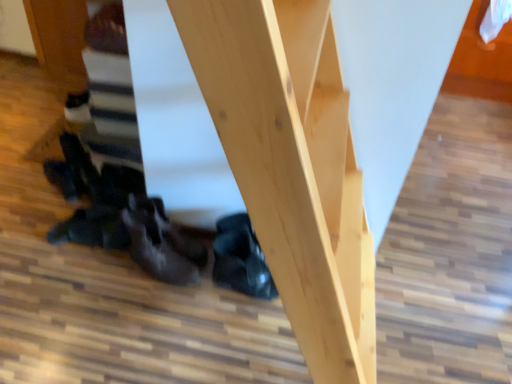
Question: Is black leather shoe at lower center, the second leather shoe viewed from the left, inside dark brown leather shoe at center, the 2th leather shoe in the right-to-left sequence?

Choices:
 (A) no
 (B) yes

Answer: (A)

Question: Is dark brown leather shoe at center, the 2th leather shoe in the right-to-left sequence, thinner than black leather shoe at lower center, which is the 1th leather shoe in right-to-left order?

Choices:
 (A) yes
 (B) no

Answer: (B)

Question: Would you say dark brown leather shoe at center, positioned as the first leather shoe in left-to-right order, is outside black leather shoe at lower center, the second leather shoe viewed from the left?

Choices:
 (A) no
 (B) yes

Answer: (B)

Question: Does dark brown leather shoe at center, the 2th leather shoe in the right-to-left sequence, have a smaller size compared to black leather shoe at lower center, which is the 1th leather shoe in right-to-left order?

Choices:
 (A) yes
 (B) no

Answer: (B)

Question: Does dark brown leather shoe at center, positioned as the first leather shoe in left-to-right order, have a greater width compared to black leather shoe at lower center, which is the 1th leather shoe in right-to-left order?

Choices:
 (A) no
 (B) yes

Answer: (B)

Question: Is dark brown leather shoe at center, positioned as the first leather shoe in left-to-right order, looking in the opposite direction of black leather shoe at lower center, the second leather shoe viewed from the left?

Choices:
 (A) no
 (B) yes

Answer: (A)

Question: Can you confirm if black leather shoe at lower center, the second leather shoe viewed from the left, is thinner than dark brown leather shoe at center, positioned as the first leather shoe in left-to-right order?

Choices:
 (A) yes
 (B) no

Answer: (A)

Question: From the image's perspective, is black leather shoe at lower center, the second leather shoe viewed from the left, beneath dark brown leather shoe at center, positioned as the first leather shoe in left-to-right order?

Choices:
 (A) yes
 (B) no

Answer: (B)

Question: Is black leather shoe at lower center, which is the 1th leather shoe in right-to-left order, wider than dark brown leather shoe at center, the 2th leather shoe in the right-to-left sequence?

Choices:
 (A) no
 (B) yes

Answer: (A)

Question: Does black leather shoe at lower center, which is the 1th leather shoe in right-to-left order, appear on the left side of dark brown leather shoe at center, positioned as the first leather shoe in left-to-right order?

Choices:
 (A) yes
 (B) no

Answer: (B)

Question: Can you confirm if black leather shoe at lower center, which is the 1th leather shoe in right-to-left order, is taller than dark brown leather shoe at center, the 2th leather shoe in the right-to-left sequence?

Choices:
 (A) no
 (B) yes

Answer: (A)

Question: Is dark brown leather shoe at center, the 2th leather shoe in the right-to-left sequence, inside black leather shoe at lower center, the second leather shoe viewed from the left?

Choices:
 (A) no
 (B) yes

Answer: (A)

Question: From a real-world perspective, relative to black leather shoe at lower center, the second leather shoe viewed from the left, is dark brown leather shoe at center, positioned as the first leather shoe in left-to-right order, vertically above or below?

Choices:
 (A) above
 (B) below

Answer: (A)